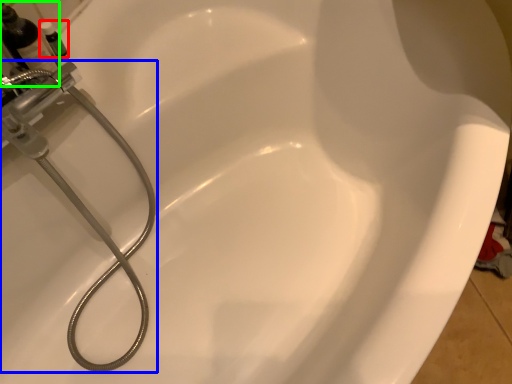
Question: Considering the real-world distances, which object is farthest from toiletry (highlighted by a red box)? plumbing fixture (highlighted by a blue box) or bottle (highlighted by a green box)?

Choices:
 (A) plumbing fixture
 (B) bottle

Answer: (A)